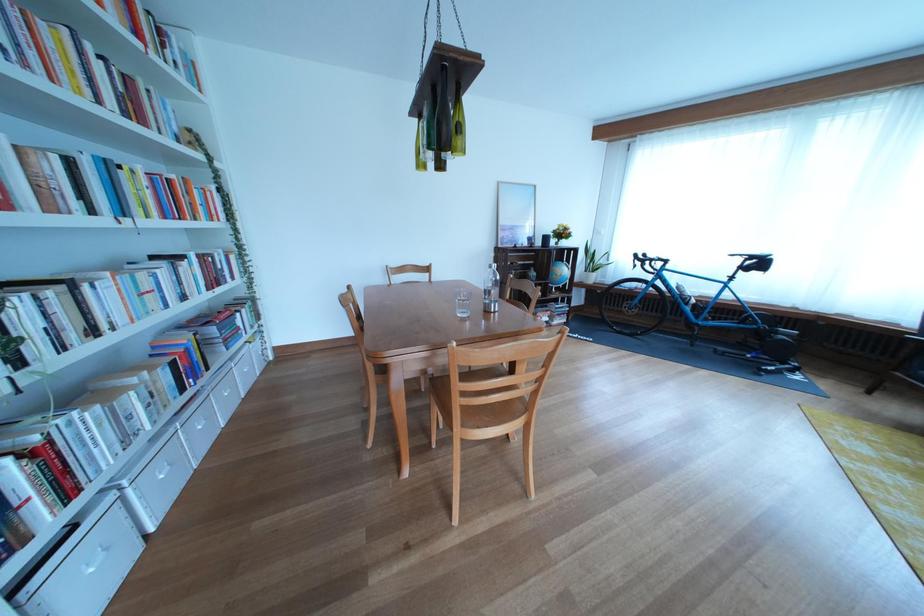
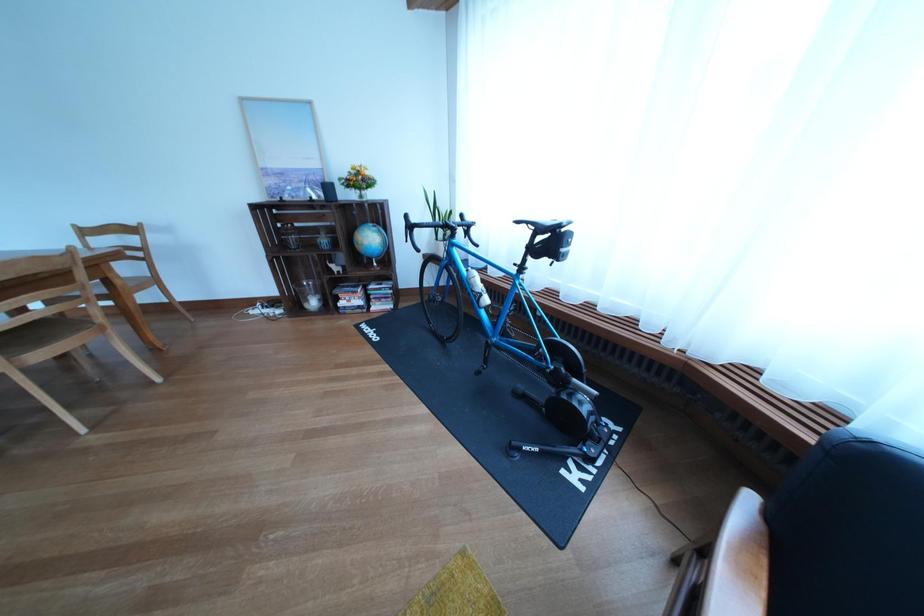
In the second image, find the point that corresponds to point (704, 351) in the first image.

(492, 379)